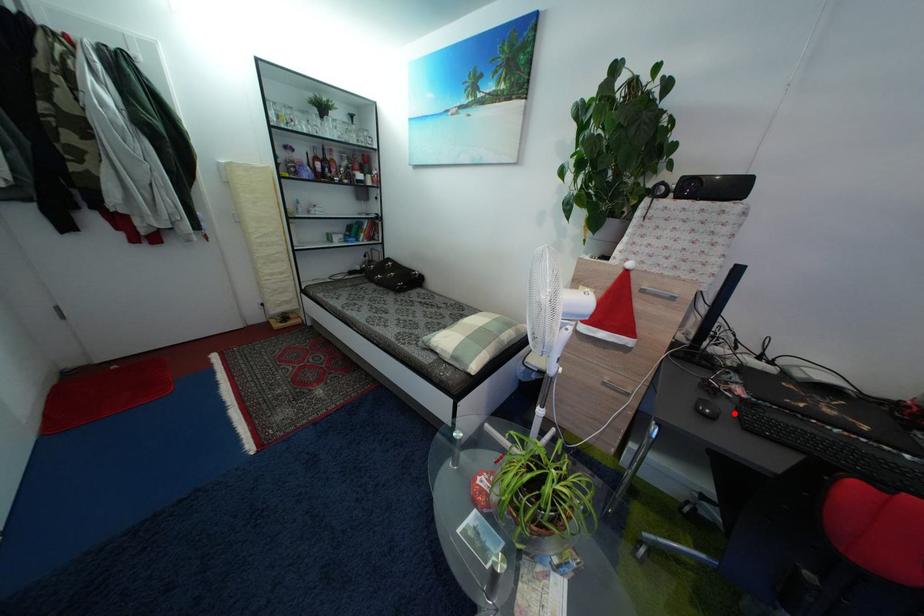
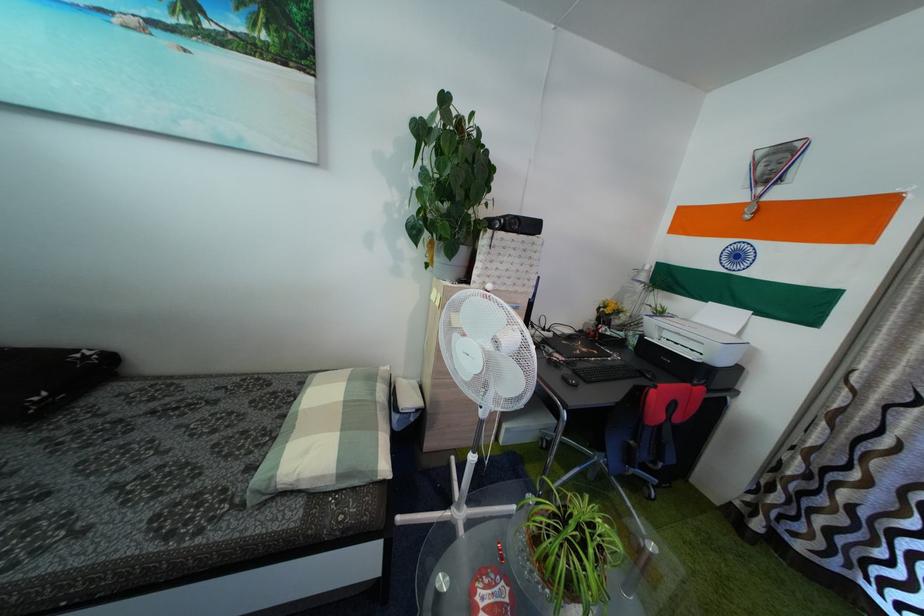
Locate, in the second image, the point that corresponds to the highlighted location in the first image.

(575, 379)